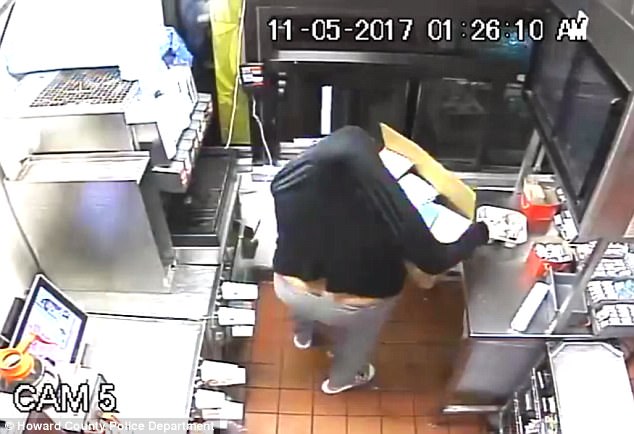
Where is `empty space on counter`? The height and width of the screenshot is (434, 634). empty space on counter is located at coordinates (160, 361).